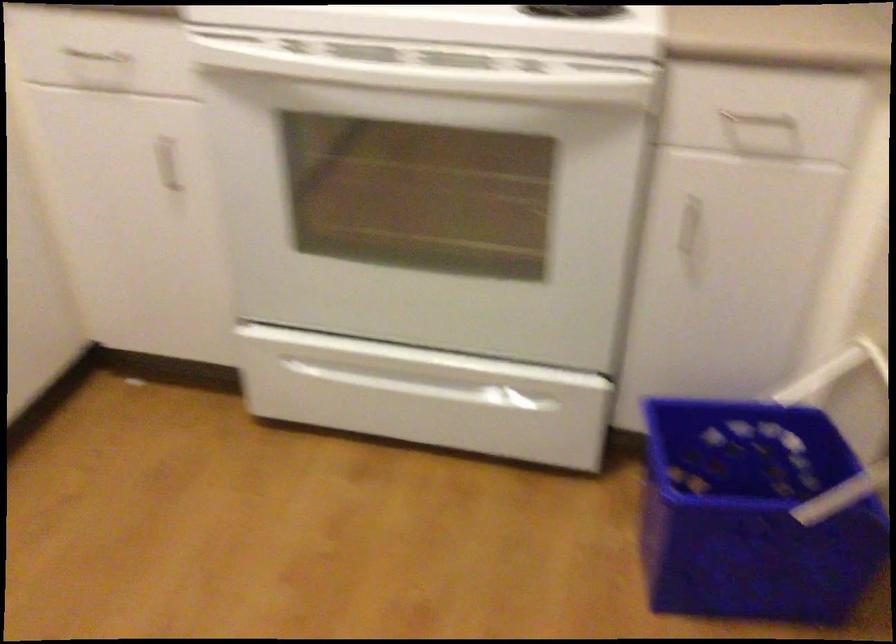
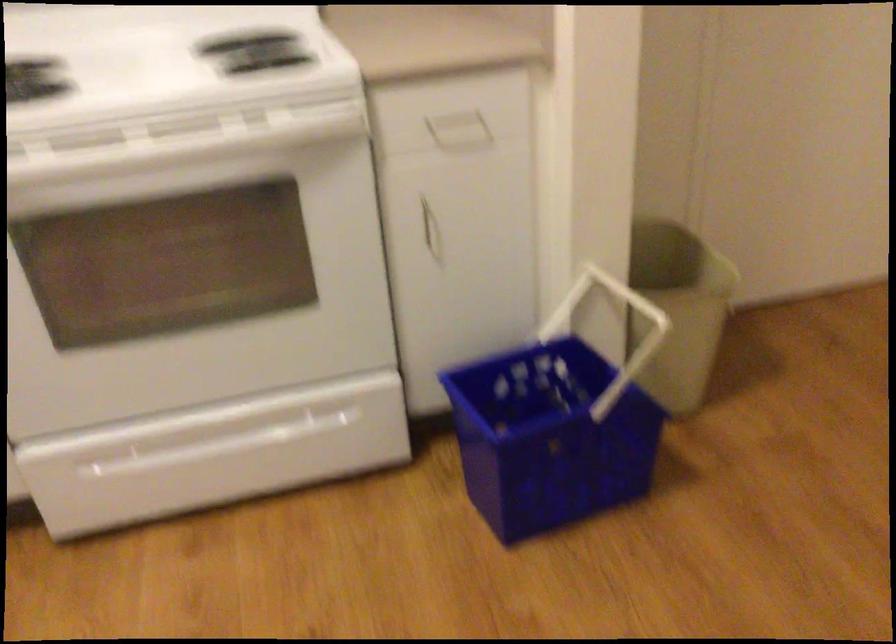
Locate, in the second image, the point that corresponds to pixel 419 384 in the first image.

(233, 440)